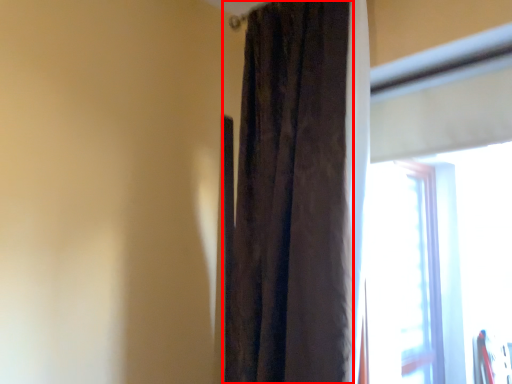
Question: From the image's perspective, where is curtain (annotated by the red box) located in relation to window in the image?

Choices:
 (A) below
 (B) above

Answer: (B)